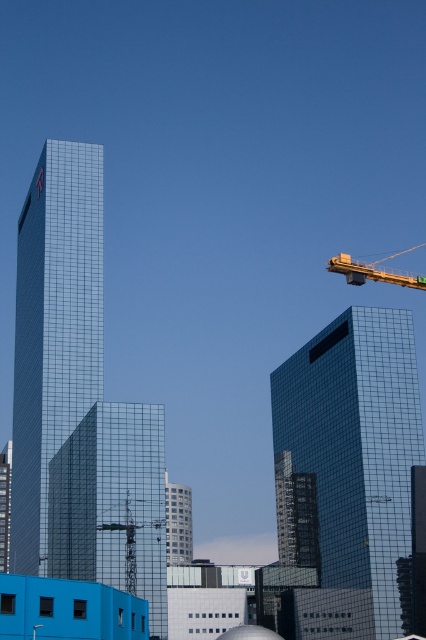
You are standing in the middle of the urban skyline and want to reach the two points marked in the image. Which point, point at (45, 433) or point at (175, 502), is closer to you?

Point at (45, 433) is closer to the viewer than point at (175, 502).

You are an architect reviewing the city layout. You notice the shiny glass building at center and the glossy glass tower at left. Which of these two structures is located closer to the ground level?

The shiny glass building at center is positioned under the glossy glass tower at left, meaning it is closer to the ground level.

You are standing in the city park and see the shiny glass tower at center and the metallic yellow crane at upper right. Which one is positioned more to the left side?

The shiny glass tower at center is positioned more to the left side than the metallic yellow crane at upper right.